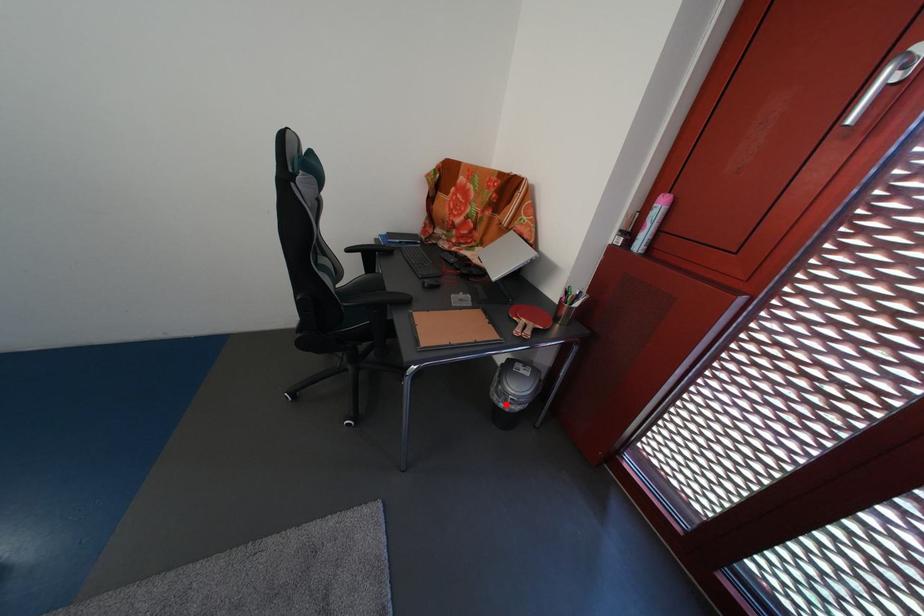
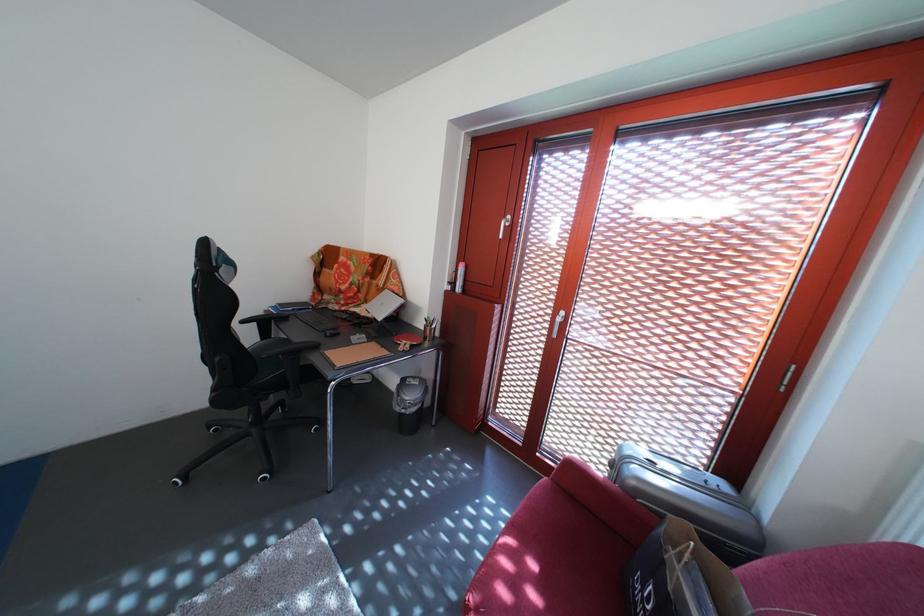
In the second image, find the point that corresponds to the highlighted location in the first image.

(408, 416)